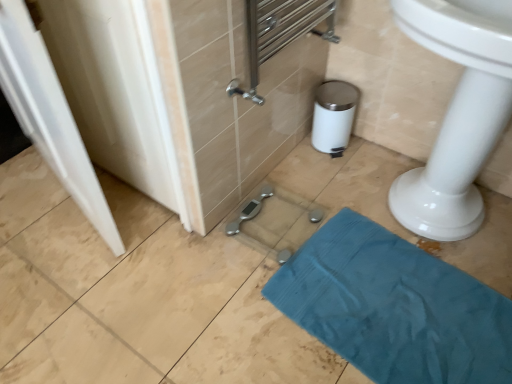
Question: Is teal fabric towel at lower right thinner than white glossy door at left?

Choices:
 (A) no
 (B) yes

Answer: (A)

Question: Is teal fabric towel at lower right positioned before white glossy door at left?

Choices:
 (A) no
 (B) yes

Answer: (A)

Question: Is teal fabric towel at lower right facing towards white glossy door at left?

Choices:
 (A) yes
 (B) no

Answer: (B)

Question: From the image's perspective, is teal fabric towel at lower right under white glossy door at left?

Choices:
 (A) no
 (B) yes

Answer: (B)

Question: Is teal fabric towel at lower right positioned with its back to white glossy door at left?

Choices:
 (A) yes
 (B) no

Answer: (B)

Question: Would you say teal fabric towel at lower right is a long distance from white glossy door at left?

Choices:
 (A) yes
 (B) no

Answer: (B)

Question: Does white glossy door at left have a greater height compared to teal fabric towel at lower right?

Choices:
 (A) no
 (B) yes

Answer: (B)

Question: Considering the relative sizes of white glossy door at left and teal fabric towel at lower right in the image provided, is white glossy door at left thinner than teal fabric towel at lower right?

Choices:
 (A) no
 (B) yes

Answer: (B)

Question: From a real-world perspective, is white glossy door at left beneath teal fabric towel at lower right?

Choices:
 (A) yes
 (B) no

Answer: (B)

Question: Is white glossy door at left looking in the opposite direction of teal fabric towel at lower right?

Choices:
 (A) no
 (B) yes

Answer: (A)

Question: Would you say teal fabric towel at lower right is part of white glossy door at left's contents?

Choices:
 (A) yes
 (B) no

Answer: (B)

Question: Is white glossy door at left not inside teal fabric towel at lower right?

Choices:
 (A) yes
 (B) no

Answer: (A)

Question: Considering the positions of teal fabric towel at lower right and white glossy door at left in the image, is teal fabric towel at lower right taller or shorter than white glossy door at left?

Choices:
 (A) short
 (B) tall

Answer: (A)